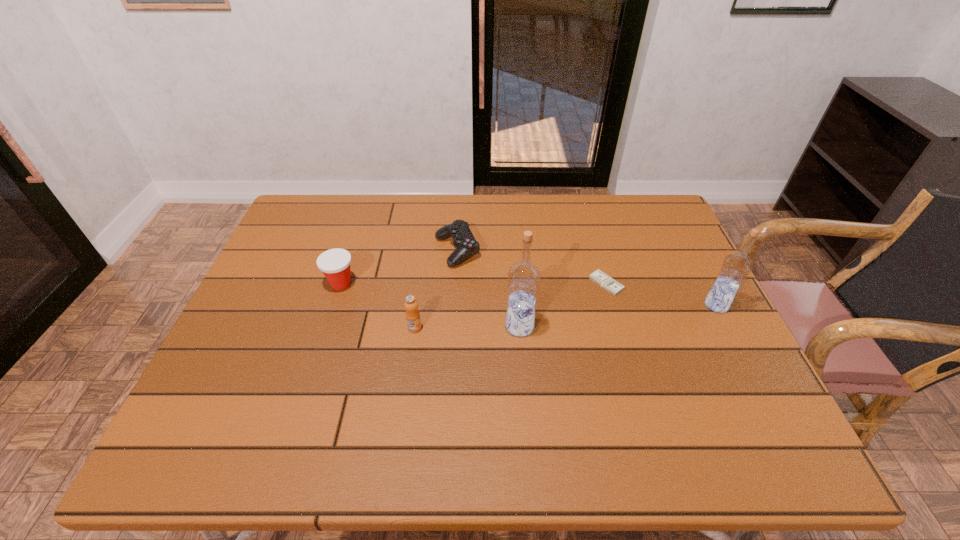
I want to click on free space at the far edge, so click(x=562, y=218).

Locate an element on the screen. This screenshot has width=960, height=540. vacant area at the near edge is located at coordinates (521, 405).

Where is `blank area at the left edge`? blank area at the left edge is located at coordinates point(278,266).

This screenshot has height=540, width=960. Find the location of `vacant region at the right edge of the desktop`. vacant region at the right edge of the desktop is located at coordinates (703, 287).

Locate an element on the screen. This screenshot has width=960, height=540. vacant region at the far left corner of the desktop is located at coordinates (296, 229).

Find the location of a particular element. This screenshot has width=960, height=540. vacant space at the near left corner of the desktop is located at coordinates (232, 404).

Identify the location of blank area at the far right corner. (624, 229).

This screenshot has width=960, height=540. Identify the location of free space between the tallest object and the third nearest object. (618, 316).

At what (x,y) coordinates should I click in order to perform the action: click on empty location between the money and the Dixie cup. Please return your answer as a coordinate pair (x, y). The height and width of the screenshot is (540, 960). Looking at the image, I should click on (473, 284).

This screenshot has width=960, height=540. Identify the location of vacant area between the second object from left to right and the third object from right to left. (468, 327).